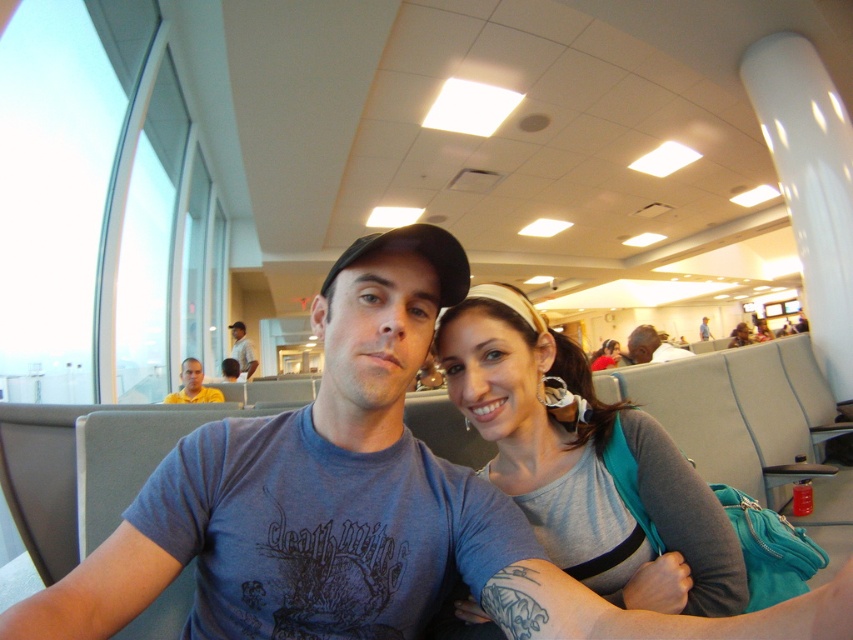
Does yellow shirt at center have a greater width compared to yellow t-shirt at center?

No, yellow shirt at center is not wider than yellow t-shirt at center.

Does point (198, 384) lie in front of point (235, 353)?

That is True.

Between point (207, 392) and point (236, 349), which one is positioned behind?

Positioned behind is point (236, 349).

The image size is (853, 640). What are the coordinates of `yellow shirt at center` in the screenshot? It's located at (193, 385).

Between smooth brown leather bag at center and matte gray purse at center, which one appears on the left side from the viewer's perspective?

From the viewer's perspective, smooth brown leather bag at center appears more on the left side.

Is the position of smooth brown leather bag at center more distant than that of matte gray purse at center?

No.

The height and width of the screenshot is (640, 853). Describe the element at coordinates (651, 346) in the screenshot. I see `smooth brown leather bag at center` at that location.

I want to click on smooth brown leather bag at center, so click(651, 346).

Who is higher up, gray fabric shirt at center or smooth brown leather bag at center?

smooth brown leather bag at center

Is gray fabric shirt at center taller than smooth brown leather bag at center?

Yes, gray fabric shirt at center is taller than smooth brown leather bag at center.

Does point (584, 582) lie behind point (657, 348)?

No, it is not.

In order to click on gray fabric shirt at center in this screenshot , I will do (x=583, y=461).